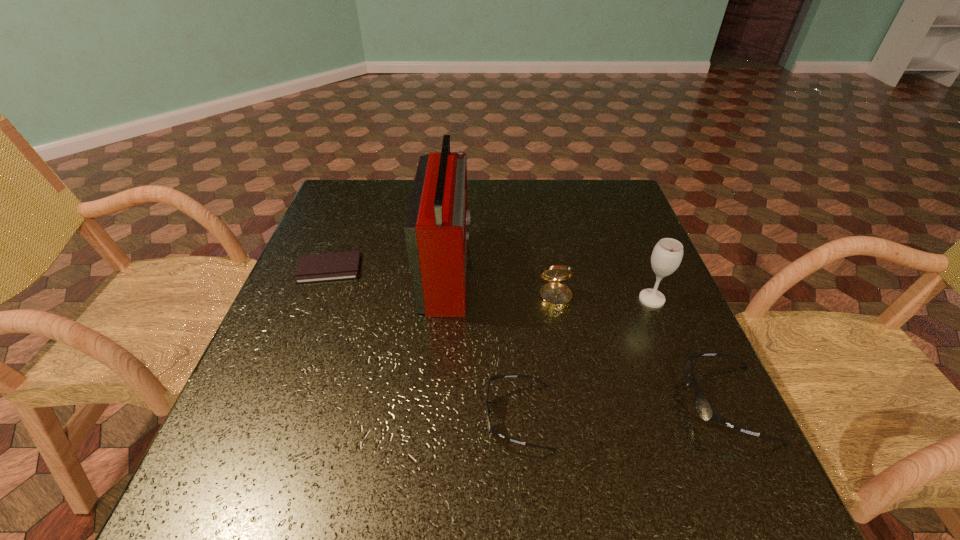
At what (x,y) coordinates should I click in order to perform the action: click on the third object from right to left. Please return your answer as a coordinate pair (x, y). The height and width of the screenshot is (540, 960). Looking at the image, I should click on [554, 295].

This screenshot has height=540, width=960. What are the coordinates of `free space located 0.310m on the front-facing side of the left sunglasses` in the screenshot? It's located at (314, 416).

Where is `vacant position located on the front-facing side of the left sunglasses`? vacant position located on the front-facing side of the left sunglasses is located at coordinates (336, 416).

The image size is (960, 540). I want to click on free region located 0.290m on the front-facing side of the left sunglasses, so click(324, 416).

Where is `free region located 0.300m on the front-facing side of the taller sunglasses`? free region located 0.300m on the front-facing side of the taller sunglasses is located at coordinates (524, 403).

What are the coordinates of `vacant position located on the front-facing side of the taller sunglasses` in the screenshot? It's located at (611, 403).

Identify the location of free point located on the front-facing side of the taller sunglasses. This screenshot has width=960, height=540. (654, 403).

Find the location of `free spot located on the front-facing side of the tallest object`. free spot located on the front-facing side of the tallest object is located at coordinates (512, 269).

The image size is (960, 540). What are the coordinates of `free space located on the front of the second tallest object` in the screenshot? It's located at (712, 448).

This screenshot has height=540, width=960. In order to click on vacant space located 0.350m on the back of the leftmost object in this screenshot , I will do `click(362, 184)`.